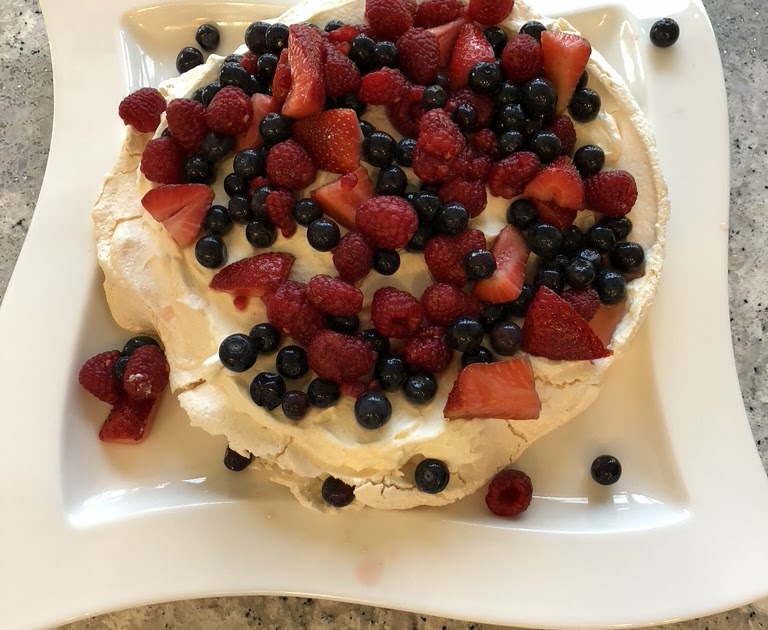
You are a GUI agent. You are given a task and a screenshot of the screen. Output one action in this format:
    pyautogui.click(x=<x>, y=<y>)
    Task: Click on the granite countertop
    
    Given the screenshot: What is the action you would take?
    pyautogui.click(x=336, y=622)